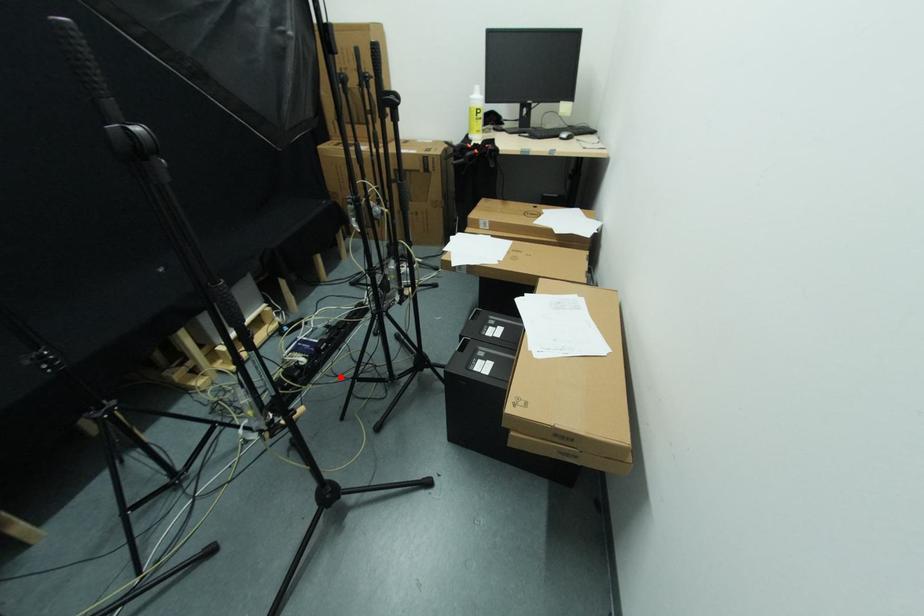
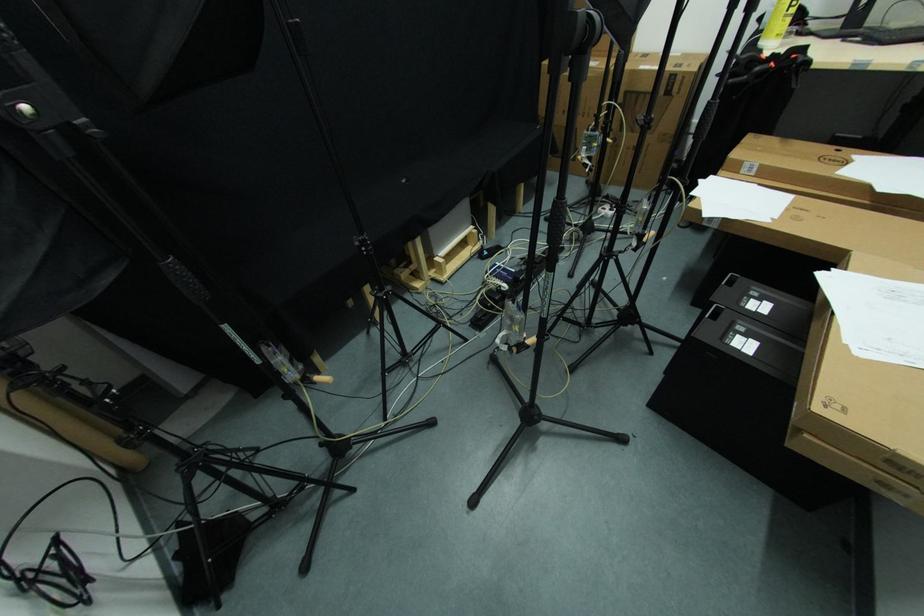
In the second image, find the point that corresponds to the highlighted location in the first image.

(535, 310)